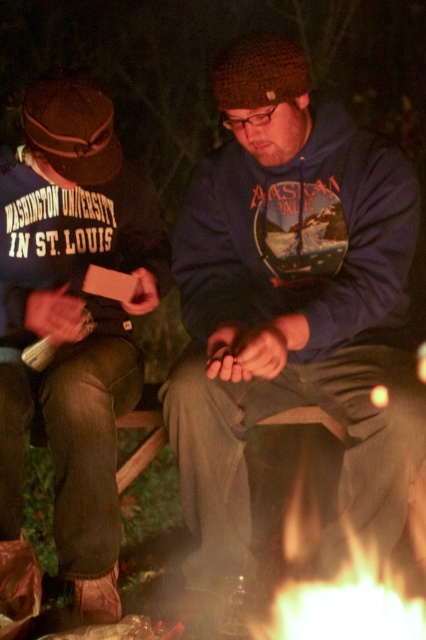
Is matte brown hat at left further to camera compared to flametransparentfire at lower center?

Yes.

Can you confirm if matte brown hat at left is positioned above flametransparentfire at lower center?

Correct, matte brown hat at left is located above flametransparentfire at lower center.

Locate an element on the screen. The image size is (426, 640). matte brown hat at left is located at coordinates (72, 323).

Is blue fleece hoodie at center above matte brown hat at left?

Yes, blue fleece hoodie at center is above matte brown hat at left.

Which is behind, point (336, 172) or point (2, 416)?

Point (336, 172)

Identify the location of blue fleece hoodie at center. (290, 307).

Is blue fleece hoodie at center behind flametransparentfire at lower center?

Yes, it is behind flametransparentfire at lower center.

Can you confirm if blue fleece hoodie at center is positioned to the left of flametransparentfire at lower center?

Yes, blue fleece hoodie at center is to the left of flametransparentfire at lower center.

Is point (233, 339) more distant than point (310, 518)?

No, (233, 339) is in front of (310, 518).

This screenshot has width=426, height=640. Find the location of `blue fleece hoodie at center`. blue fleece hoodie at center is located at coordinates (290, 307).